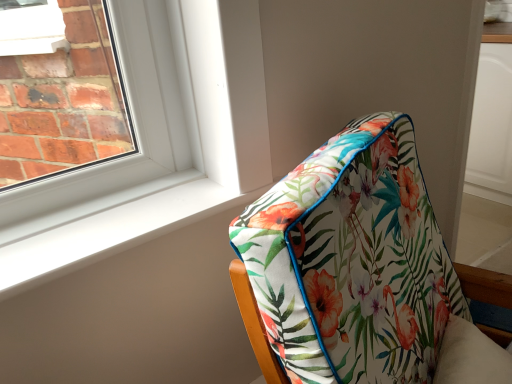
Question: Based on their sizes in the image, would you say white smooth window sill at lower left is bigger or smaller than floral fabric cushion at center?

Choices:
 (A) big
 (B) small

Answer: (B)

Question: From a real-world perspective, is white smooth window sill at lower left positioned above or below floral fabric cushion at center?

Choices:
 (A) above
 (B) below

Answer: (A)

Question: From the image's perspective, is white smooth window sill at lower left above or below floral fabric cushion at center?

Choices:
 (A) below
 (B) above

Answer: (B)

Question: From the image's perspective, relative to white smooth window sill at lower left, is floral fabric cushion at center above or below?

Choices:
 (A) below
 (B) above

Answer: (A)

Question: Considering the positions of point 306,248 and point 181,215, is point 306,248 closer or farther from the camera than point 181,215?

Choices:
 (A) farther
 (B) closer

Answer: (B)

Question: Considering the positions of floral fabric cushion at center and white smooth window sill at lower left in the image, is floral fabric cushion at center wider or thinner than white smooth window sill at lower left?

Choices:
 (A) thin
 (B) wide

Answer: (B)

Question: Do you think floral fabric cushion at center is within white smooth window sill at lower left, or outside of it?

Choices:
 (A) outside
 (B) inside

Answer: (A)